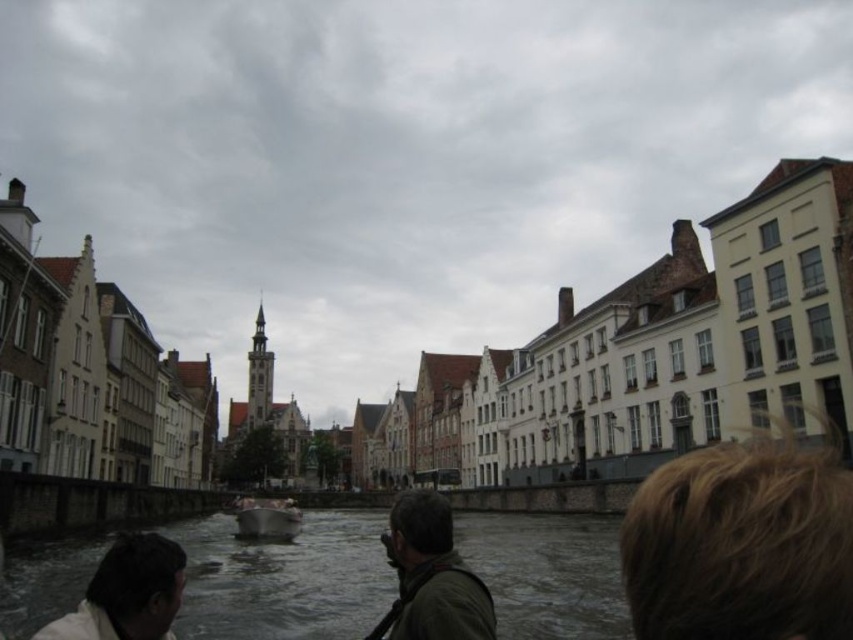
You are standing on the dock and want to throw a stone into the gray water at center. What are the coordinates where you should aim?

The gray water at center is located at coordinates (283, 579), so aim for that point.